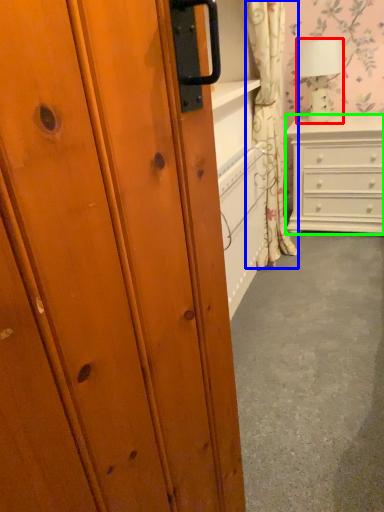
Question: Which is nearer to the lamp (highlighted by a red box)? curtain (highlighted by a blue box) or chest of drawers (highlighted by a green box).

Choices:
 (A) curtain
 (B) chest of drawers

Answer: (B)